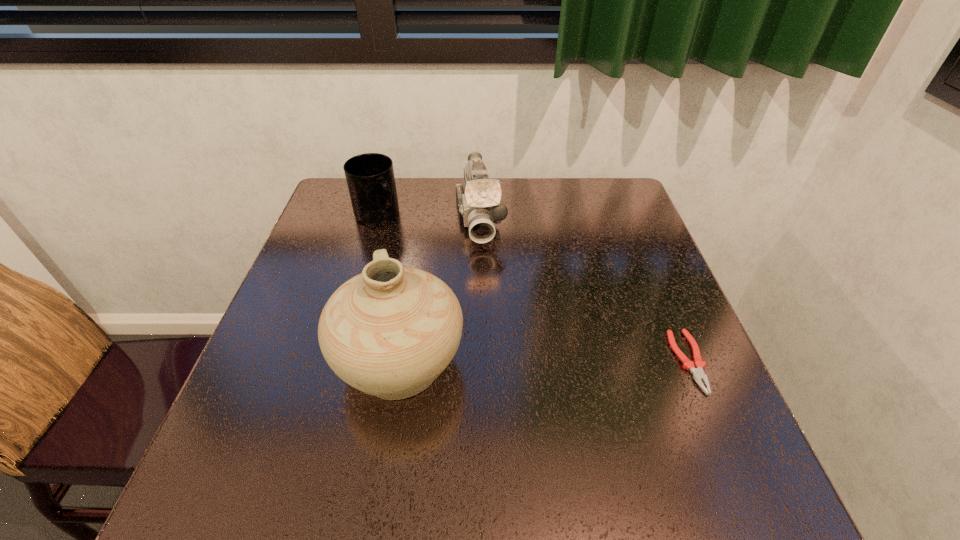
Where is `object positioned at the near left corner`? This screenshot has height=540, width=960. object positioned at the near left corner is located at coordinates (390, 331).

You are a GUI agent. You are given a task and a screenshot of the screen. Output one action in this format:
    pyautogui.click(x=<x>, y=<y>)
    Task: Click on the blank area at the far edge
    The image size is (960, 540).
    Given the screenshot: What is the action you would take?
    pyautogui.click(x=517, y=215)

Where is `vacant space at the near edge`? vacant space at the near edge is located at coordinates (541, 417).

Where is `vacant space at the left edge`? This screenshot has width=960, height=540. vacant space at the left edge is located at coordinates (282, 368).

Locate an element on the screen. The height and width of the screenshot is (540, 960). vacant area at the right edge is located at coordinates (606, 262).

The width and height of the screenshot is (960, 540). Find the location of `vacant region at the near left corner of the desktop`. vacant region at the near left corner of the desktop is located at coordinates (294, 430).

Find the location of a particular element. This screenshot has height=540, width=960. free space at the far right corner of the desktop is located at coordinates (629, 213).

At what (x,y) coordinates should I click in order to perform the action: click on unoccupied area between the pottery and the shortest object. Please return your answer as a coordinate pair (x, y). The image size is (960, 540). Looking at the image, I should click on (544, 362).

I want to click on vacant point located between the camcorder and the pliers, so (585, 290).

This screenshot has width=960, height=540. What are the coordinates of `empty space that is in between the second tallest object and the mug` in the screenshot? It's located at (428, 217).